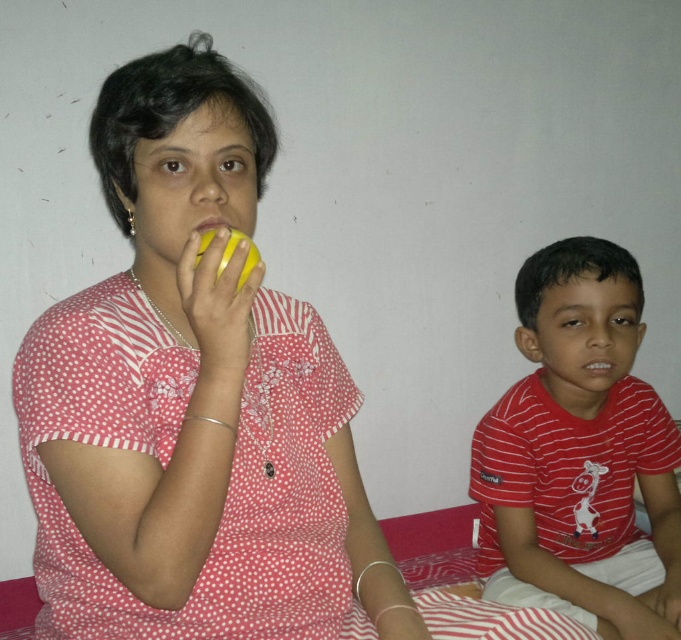
From the picture: Is matte yellow apple at left positioned behind red striped shirt at right?

That is False.

Between matte yellow apple at left and red striped shirt at right, which one is positioned lower?

red striped shirt at right

Is point (189, 145) closer to camera compared to point (545, 320)?

Yes.

What are the coordinates of `matte yellow apple at left` in the screenshot? It's located at (174, 310).

Is matte yellow apple at left taller than yellow matte apple at upper left?

Yes.

Is matte yellow apple at left further to camera compared to yellow matte apple at upper left?

No, it is in front of yellow matte apple at upper left.

Does point (151, 604) lie behind point (204, 224)?

No, (151, 604) is closer to viewer.

Where is `matte yellow apple at left`? This screenshot has width=681, height=640. matte yellow apple at left is located at coordinates (174, 310).

Which is in front, point (496, 598) or point (210, 224)?

Point (210, 224) is more forward.

Can you confirm if red striped shirt at right is positioned to the left of yellow matte apple at upper left?

Incorrect, red striped shirt at right is not on the left side of yellow matte apple at upper left.

What do you see at coordinates (580, 451) in the screenshot?
I see `red striped shirt at right` at bounding box center [580, 451].

You are a GUI agent. You are given a task and a screenshot of the screen. Output one action in this format:
    pyautogui.click(x=<x>, y=<y>)
    Task: Click on the red striped shirt at right
    Image resolution: width=681 pixels, height=640 pixels.
    Given the screenshot: What is the action you would take?
    pyautogui.click(x=580, y=451)